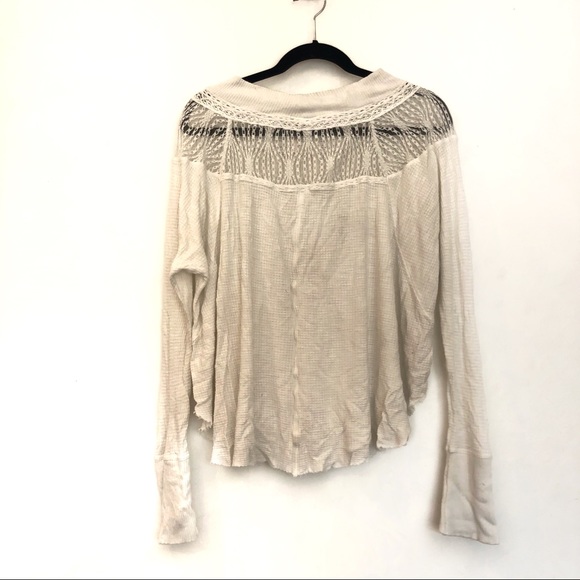
Where is `metal hanger wire`? This screenshot has width=580, height=580. metal hanger wire is located at coordinates pyautogui.click(x=322, y=9).